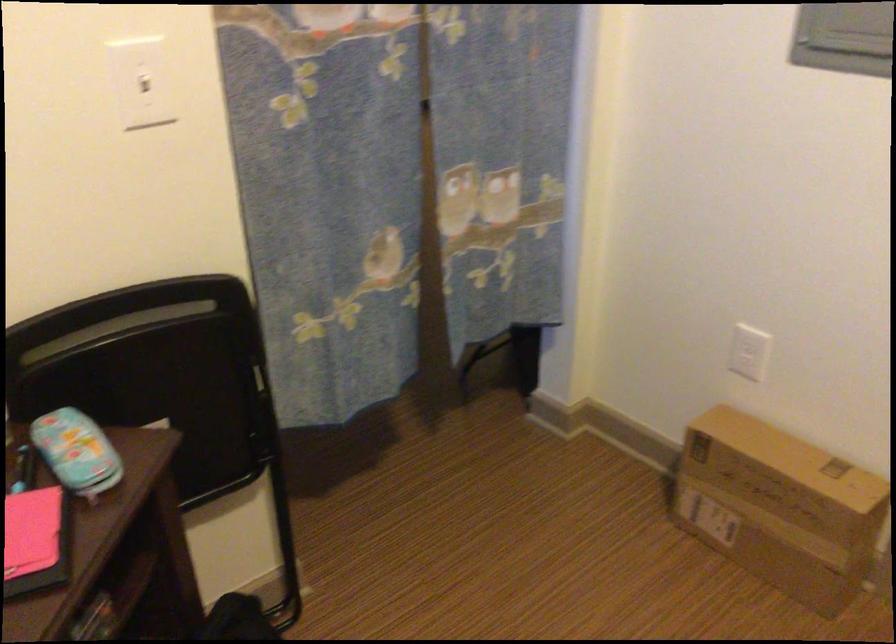
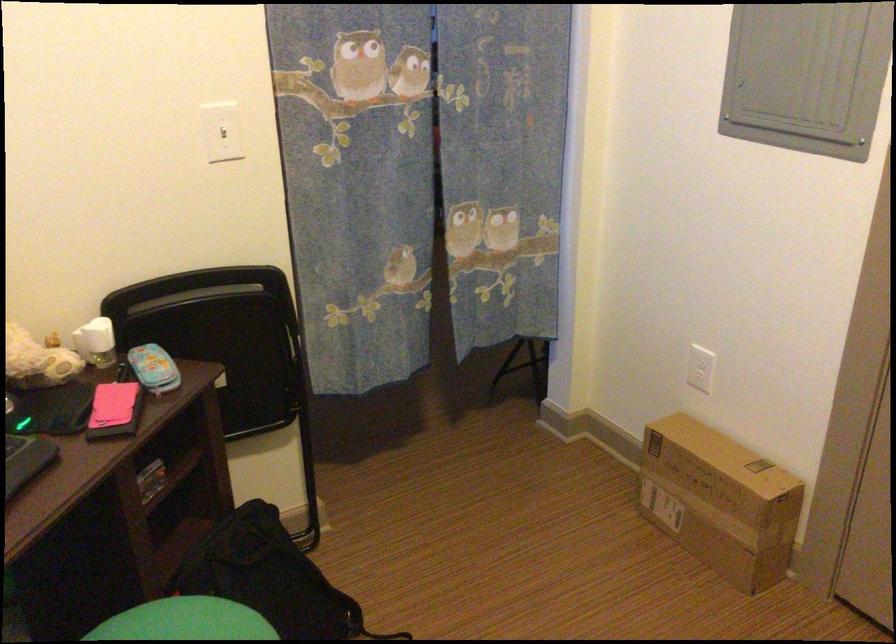
In the second image, find the point that corresponds to (x=746, y=357) in the first image.

(700, 368)